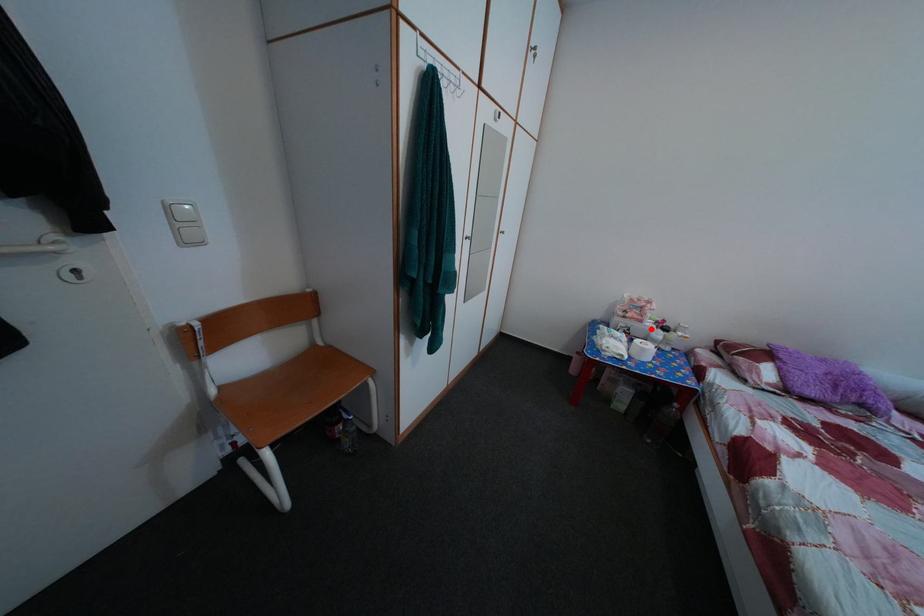
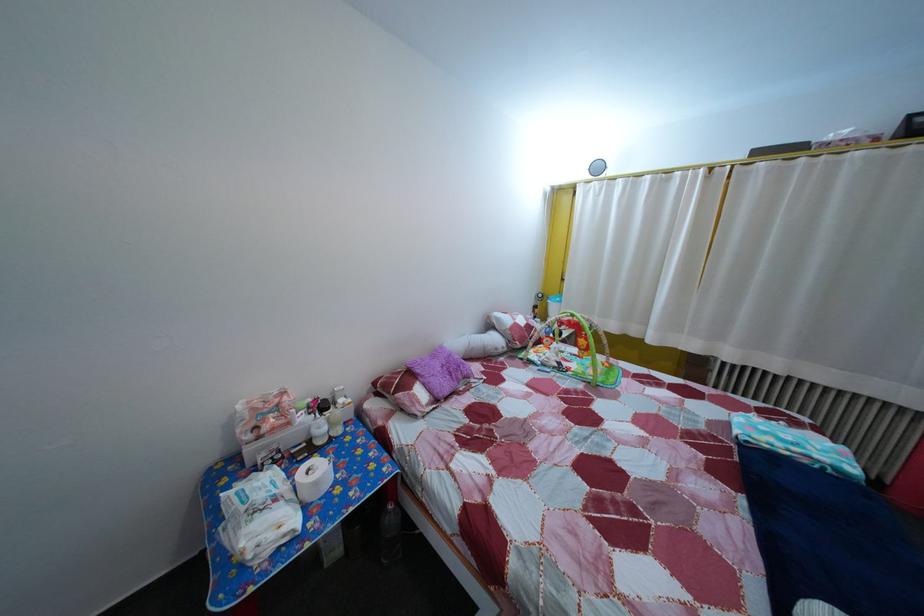
In the second image, find the point that corresponds to the highlighted location in the first image.

(298, 432)